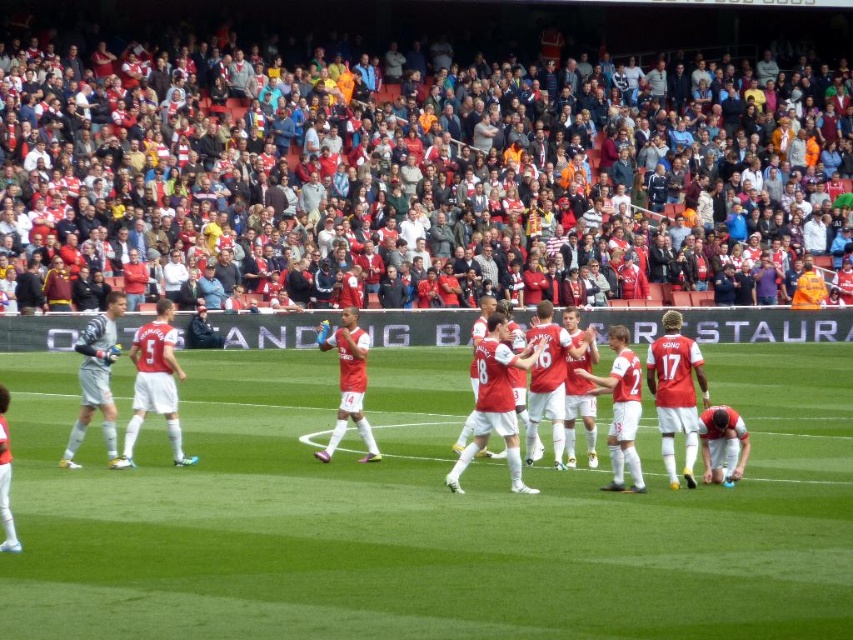
Is red fabric crowd at upper center shorter than matte red jersey at center?

In fact, red fabric crowd at upper center may be taller than matte red jersey at center.

Is point (434, 218) positioned in front of point (664, 337)?

No, it is behind (664, 337).

Where is `red fabric crowd at upper center`? red fabric crowd at upper center is located at coordinates (404, 177).

Which is more to the left, green grass football field at center or red matte jersey at center?

red matte jersey at center

Is point (593, 602) closer to viewer compared to point (318, 451)?

That is True.

Where is `green grass football field at center`? green grass football field at center is located at coordinates (424, 515).

Between matte red jersey at center and matte white jersey at left, which one has less height?

matte red jersey at center is shorter.

In the scene shown: Who is lower down, matte red jersey at center or matte white jersey at left?

matte red jersey at center is below.

The height and width of the screenshot is (640, 853). Describe the element at coordinates (612, 364) in the screenshot. I see `matte red jersey at center` at that location.

This screenshot has height=640, width=853. I want to click on matte red jersey at center, so click(x=612, y=364).